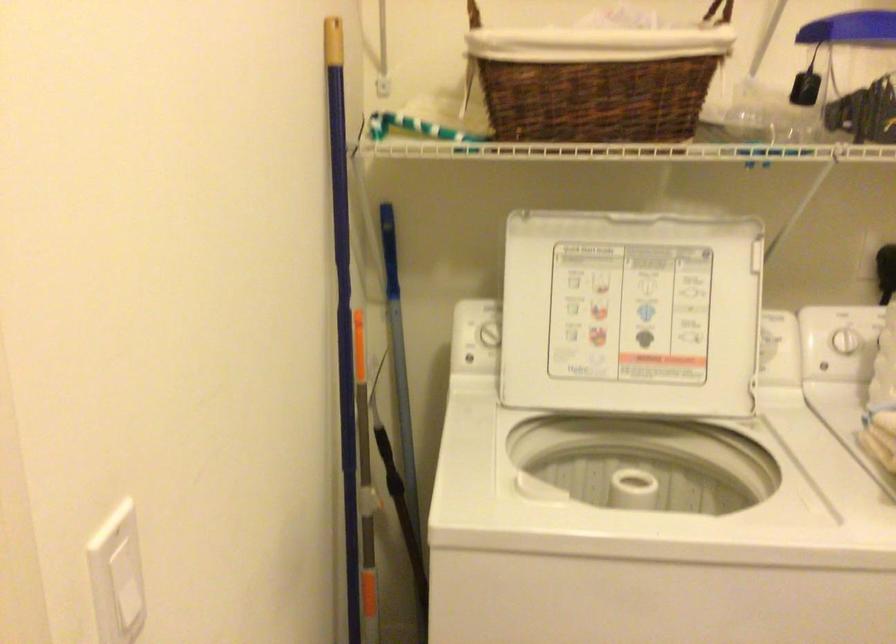
Locate an element on the screen. The width and height of the screenshot is (896, 644). gray mop handle is located at coordinates (400, 379).